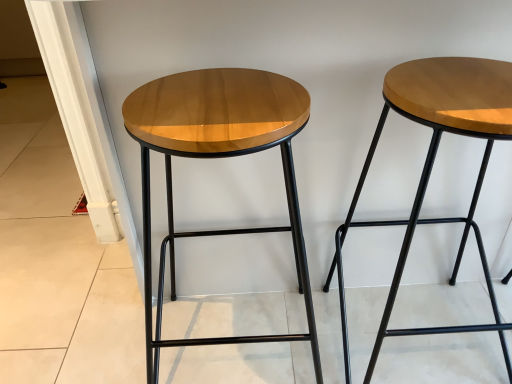
Question: Can you confirm if glossy wood stool at left, placed as the second stool when sorted from right to left, is positioned to the left of glossy wood stool at right, the 1th stool from the right?

Choices:
 (A) yes
 (B) no

Answer: (A)

Question: From a real-world perspective, is glossy wood stool at left, placed as the second stool when sorted from right to left, positioned over glossy wood stool at right, which ranks as the second stool in left-to-right order, based on gravity?

Choices:
 (A) yes
 (B) no

Answer: (A)

Question: Is glossy wood stool at left, the 1th stool positioned from the left, further to the viewer compared to glossy wood stool at right, the 1th stool from the right?

Choices:
 (A) yes
 (B) no

Answer: (B)

Question: From the image's perspective, is glossy wood stool at left, placed as the second stool when sorted from right to left, located beneath glossy wood stool at right, the 1th stool from the right?

Choices:
 (A) yes
 (B) no

Answer: (A)

Question: Considering the relative sizes of glossy wood stool at left, the 1th stool positioned from the left, and glossy wood stool at right, the 1th stool from the right, in the image provided, is glossy wood stool at left, the 1th stool positioned from the left, taller than glossy wood stool at right, the 1th stool from the right,?

Choices:
 (A) no
 (B) yes

Answer: (B)

Question: From a real-world perspective, is glossy wood stool at left, the 1th stool positioned from the left, located beneath glossy wood stool at right, which ranks as the second stool in left-to-right order?

Choices:
 (A) yes
 (B) no

Answer: (B)

Question: Could you tell me if glossy wood stool at right, the 1th stool from the right, is turned towards glossy wood stool at left, the 1th stool positioned from the left?

Choices:
 (A) no
 (B) yes

Answer: (A)

Question: Does glossy wood stool at right, which ranks as the second stool in left-to-right order, appear on the right side of glossy wood stool at left, placed as the second stool when sorted from right to left?

Choices:
 (A) yes
 (B) no

Answer: (A)

Question: From the image's perspective, is glossy wood stool at right, which ranks as the second stool in left-to-right order, on top of glossy wood stool at left, the 1th stool positioned from the left?

Choices:
 (A) no
 (B) yes

Answer: (B)

Question: From a real-world perspective, is glossy wood stool at right, which ranks as the second stool in left-to-right order, beneath glossy wood stool at left, placed as the second stool when sorted from right to left?

Choices:
 (A) yes
 (B) no

Answer: (A)

Question: Is glossy wood stool at right, which ranks as the second stool in left-to-right order, located outside glossy wood stool at left, placed as the second stool when sorted from right to left?

Choices:
 (A) yes
 (B) no

Answer: (A)

Question: Is glossy wood stool at right, the 1th stool from the right, thinner than glossy wood stool at left, the 1th stool positioned from the left?

Choices:
 (A) no
 (B) yes

Answer: (B)

Question: From the image's perspective, is glossy wood stool at right, the 1th stool from the right, above or below glossy wood stool at left, placed as the second stool when sorted from right to left?

Choices:
 (A) below
 (B) above

Answer: (B)